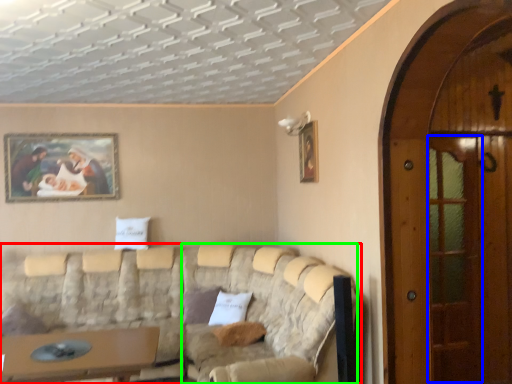
Question: Which is nearer to the studio couch (highlighted by a red box)? screen door (highlighted by a blue box) or couch (highlighted by a green box).

Choices:
 (A) screen door
 (B) couch

Answer: (B)